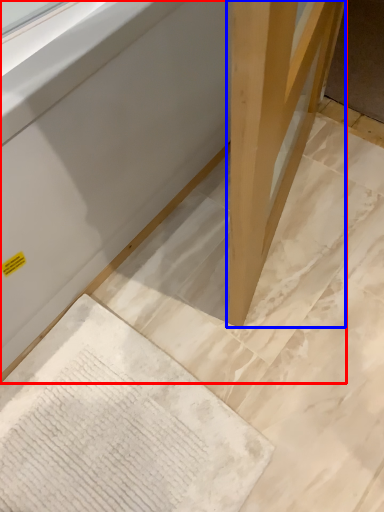
Question: Which point is further to the camera, furniture (highlighted by a red box) or wood (highlighted by a blue box)?

Choices:
 (A) furniture
 (B) wood

Answer: (B)